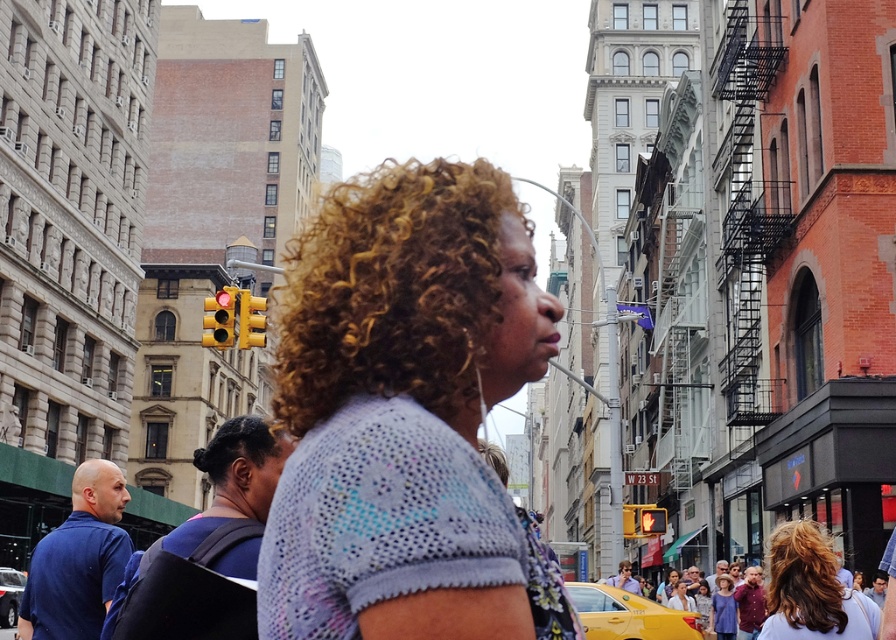
You are a photographer trying to capture a candid shot of both the curly golden hair at center and the black curly hair at center in the scene. Based on their hair length, which person should you focus on first to ensure you capture their full headshot?

The curly golden hair at center is shorter than black curly hair at center, so you should focus on the black curly hair at center first to ensure capturing their full headshot since it has a longer hair length.

You are a photographer trying to capture a candid shot of the black curly hair at center without including the curly golden hair at center in the frame. Based on their positions, is this possible?

The curly golden hair at center is located above the black curly hair at center, so it would be difficult to capture the black curly hair at center without including the curly golden hair at center in the frame.